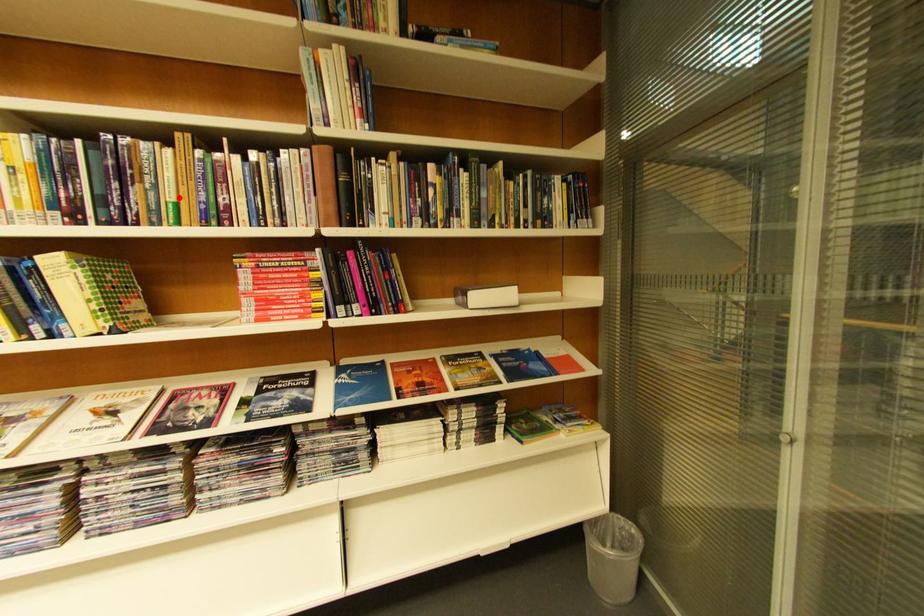
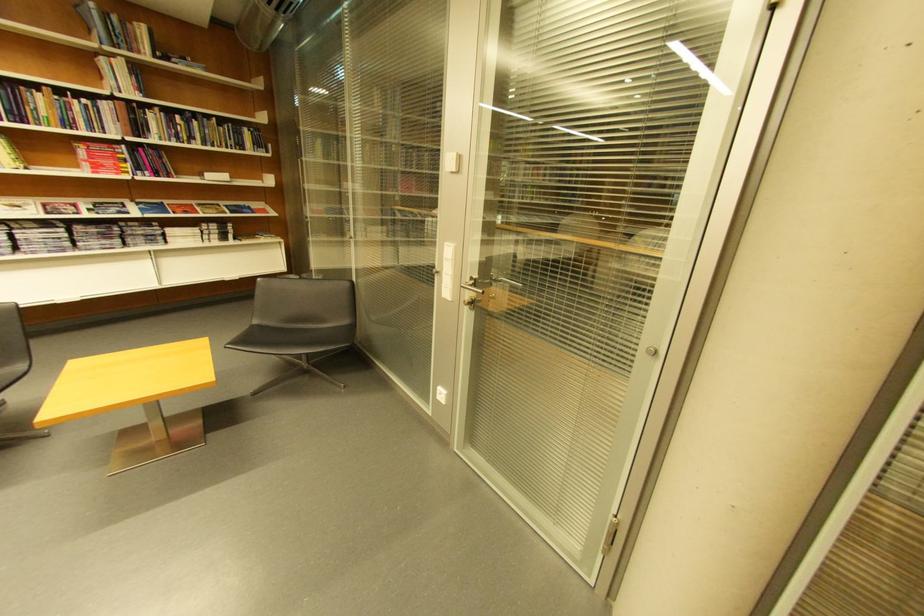
Find the pixel in the second image that matches the highlighted location in the first image.

(54, 116)